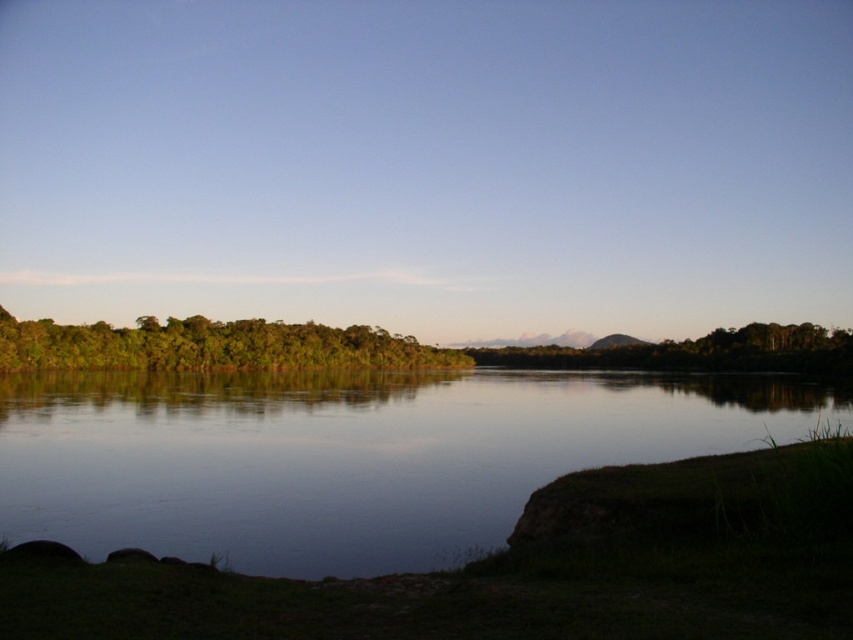
Question: Which object appears farthest from the camera in this image?

Choices:
 (A) smooth water at center
 (B) green leafy trees at left

Answer: (B)

Question: Is smooth water at center to the right of green leafy trees at left from the viewer's perspective?

Choices:
 (A) no
 (B) yes

Answer: (B)

Question: Among these objects, which one is nearest to the camera?

Choices:
 (A) smooth water at center
 (B) green leafy trees at left

Answer: (A)

Question: Can you confirm if smooth water at center is thinner than green leafy trees at left?

Choices:
 (A) yes
 (B) no

Answer: (B)

Question: Does smooth water at center have a greater width compared to green leafy trees at left?

Choices:
 (A) yes
 (B) no

Answer: (A)

Question: Which object is farther from the camera taking this photo?

Choices:
 (A) green leafy trees at left
 (B) smooth water at center

Answer: (A)